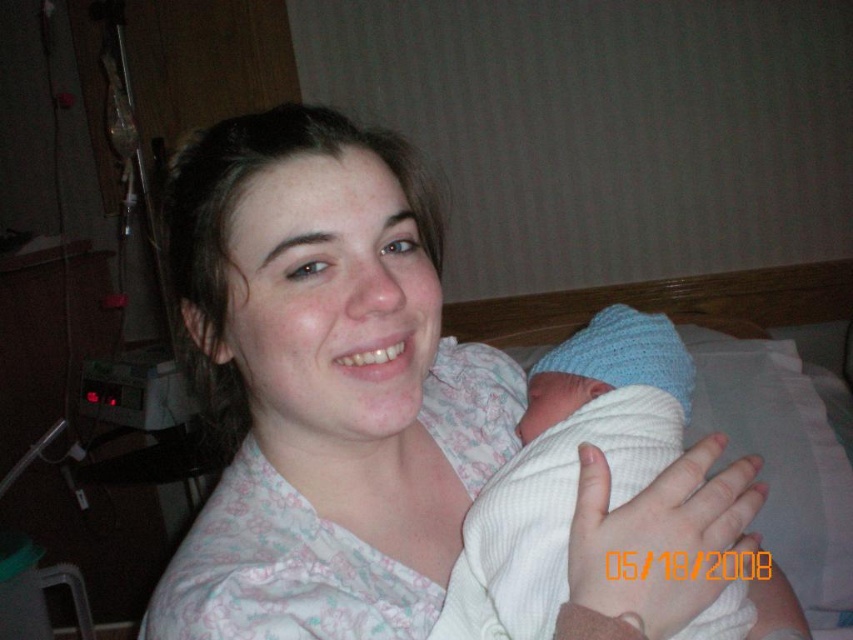
You are a nurse preparing to take a photo of the woman and baby. You need to ensure that the white cotton shirt at center and the white knit hat at upper right are both visible in the frame. Given their sizes, which object should you focus on to ensure both are in the shot?

The white cotton shirt at center is bigger than the white knit hat at upper right, so focusing on the white cotton shirt at center will ensure both are visible in the frame since it occupies more space and the smaller hat can be positioned within the same shot.

You are a photographer setting up for a photo shoot in this hospital room. You need to position a light source to the right of both the white cotton shirt at center and the white knit hat at upper right. Is this possible given their positions?

The white cotton shirt at center is to the left of the white knit hat at upper right. Since the white knit hat at upper right is already on the right side of the white cotton shirt at center, placing a light source to the right of both would require it to be positioned further to the right of the white knit hat at upper right.

You are a photographer adjusting the camera focus. The subject is the white cotton shirt at center. Where should you focus the camera to capture the shirt clearly?

The camera should focus at the point (322, 385) to capture the white cotton shirt at center clearly.